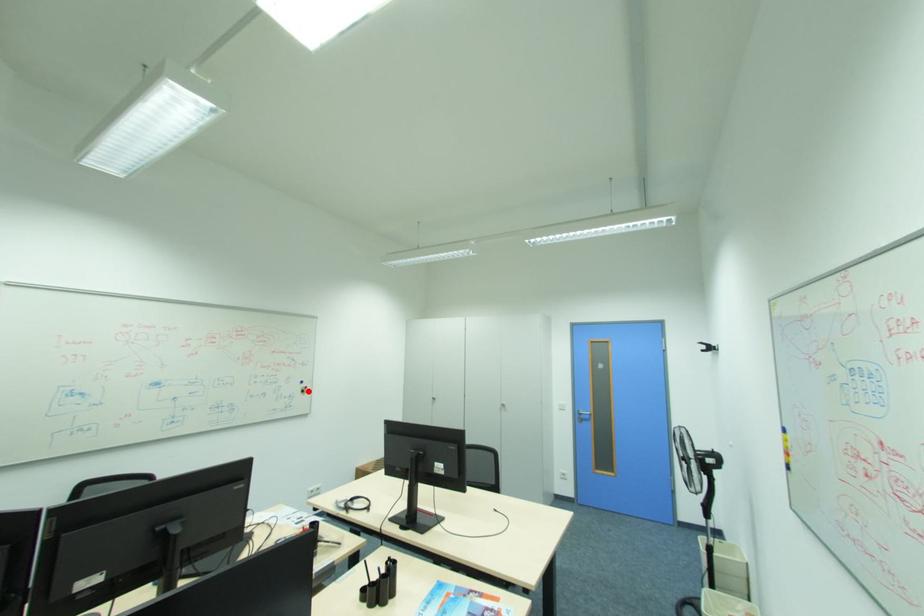
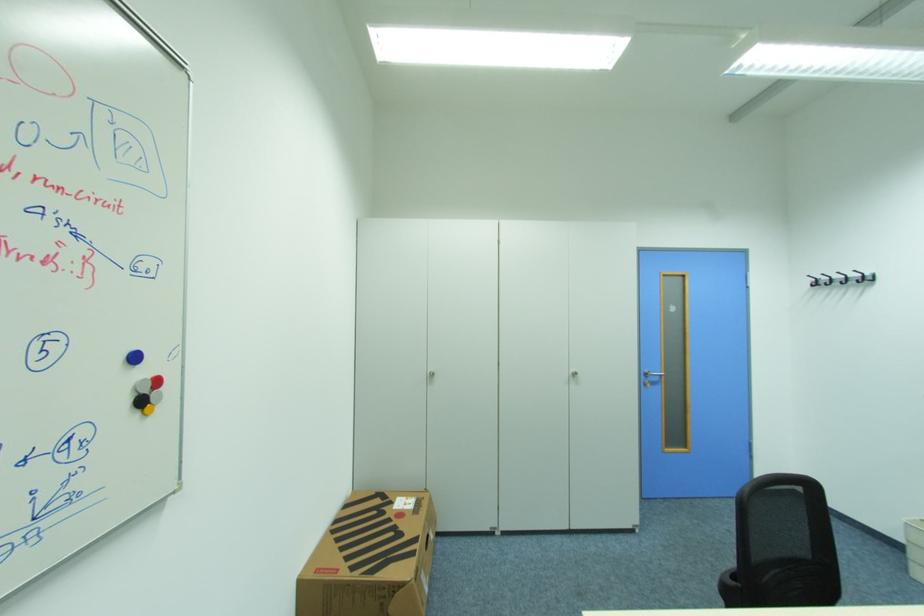
In the second image, find the point that corresponds to the highlighted location in the first image.

(146, 403)